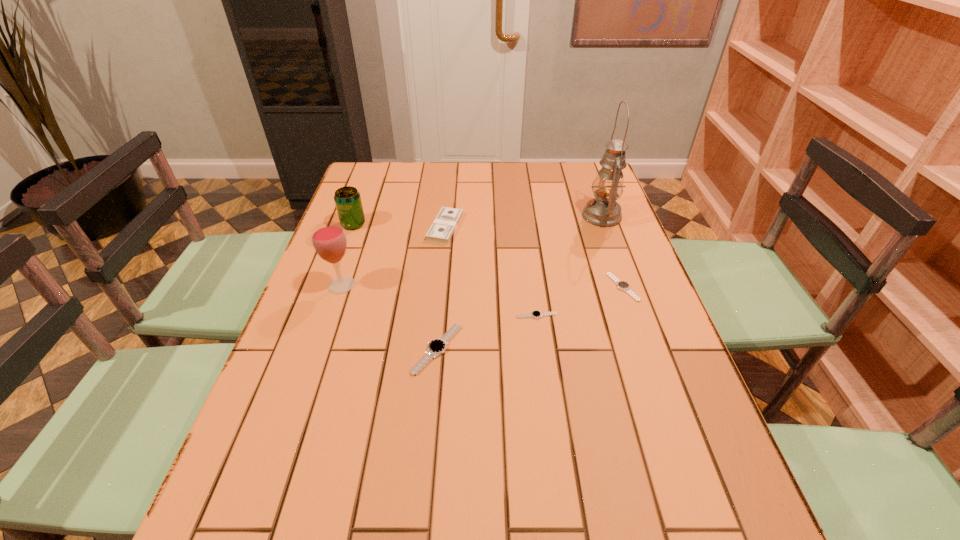
With all watchs evenly spaced, where should an extra watch be placed on the left to continue the pattern? Please point out a vacant space. Please provide its 2D coordinates. Your answer should be formatted as a tuple, i.e. [(x, y)], where the tuple contains the x and y coordinates of a point satisfying the conditions above.

[(322, 387)]